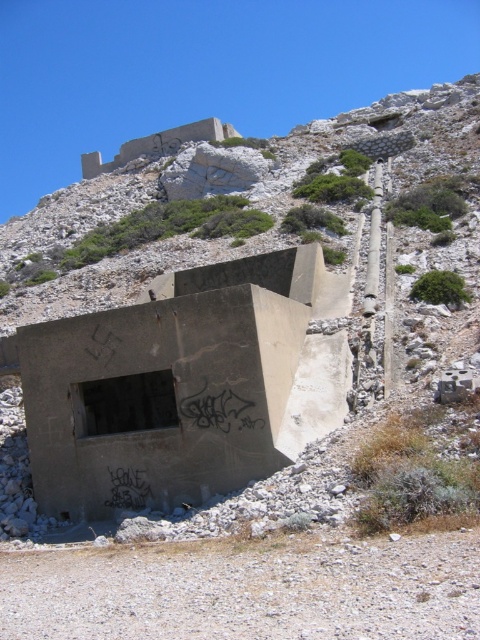
The image size is (480, 640). What do you see at coordinates (248, 317) in the screenshot? I see `concrete bunker at center` at bounding box center [248, 317].

Does concrete bunker at center have a greater width compared to gray concrete bunker at lower center?

Yes, concrete bunker at center is wider than gray concrete bunker at lower center.

The image size is (480, 640). I want to click on concrete bunker at center, so click(x=248, y=317).